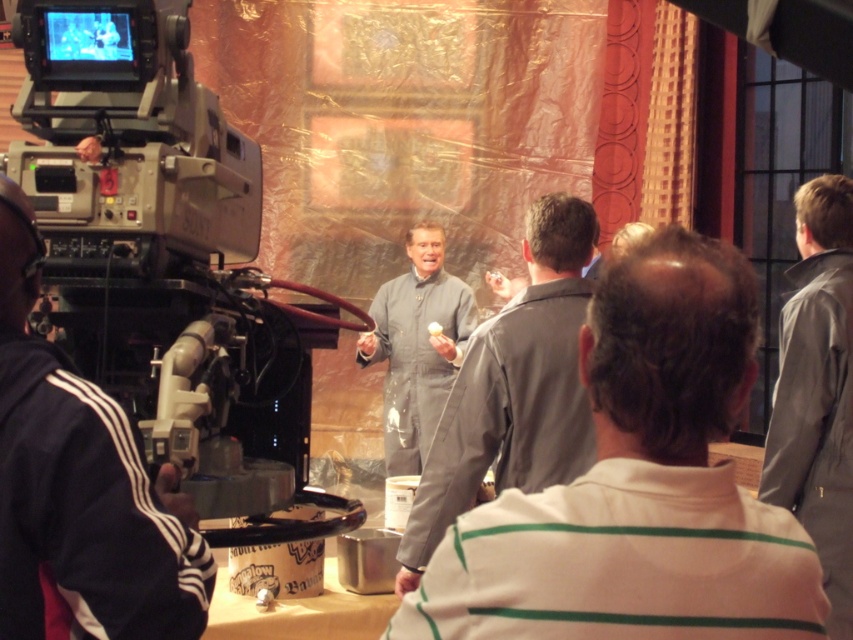
In the scene shown: Is gray fabric suit at center wider than matte gray jumpsuit at center?

Incorrect, gray fabric suit at center's width does not surpass matte gray jumpsuit at center's.

Does gray fabric suit at center have a lesser height compared to matte gray jumpsuit at center?

Correct, gray fabric suit at center is not as tall as matte gray jumpsuit at center.

Identify the location of gray fabric suit at center. (637, 484).

Image resolution: width=853 pixels, height=640 pixels. Identify the location of gray fabric suit at center. (637, 484).

I want to click on matte gray video camera at left, so click(x=166, y=256).

Does matte gray video camera at left have a lesser width compared to black matte camera at left?

No, matte gray video camera at left is not thinner than black matte camera at left.

Which is in front, point (115, 120) or point (97, 580)?

Point (97, 580) is more forward.

In order to click on matte gray video camera at left in this screenshot , I will do `click(166, 256)`.

Does black matte camera at left appear under gray leather jacket at right?

Incorrect, black matte camera at left is not positioned below gray leather jacket at right.

Can you confirm if black matte camera at left is wider than gray leather jacket at right?

Yes, black matte camera at left is wider than gray leather jacket at right.

Find the location of `black matte camera at left`. black matte camera at left is located at coordinates (80, 486).